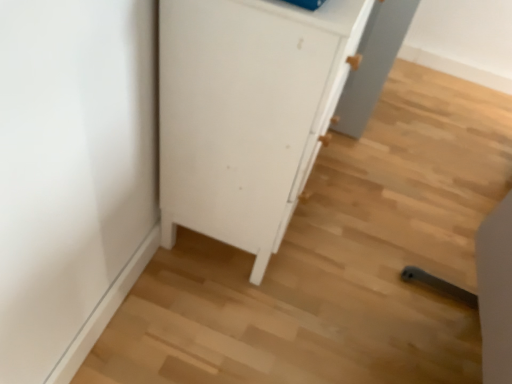
Question: From a real-world perspective, is light wood chair at lower right located higher than white matte cabinet at center?

Choices:
 (A) yes
 (B) no

Answer: (B)

Question: Does light wood chair at lower right contain white matte cabinet at center?

Choices:
 (A) no
 (B) yes

Answer: (A)

Question: Can you confirm if light wood chair at lower right is wider than white matte cabinet at center?

Choices:
 (A) yes
 (B) no

Answer: (A)

Question: Can you confirm if light wood chair at lower right is smaller than white matte cabinet at center?

Choices:
 (A) no
 (B) yes

Answer: (B)

Question: Does light wood chair at lower right lie in front of white matte cabinet at center?

Choices:
 (A) yes
 (B) no

Answer: (A)

Question: From the image's perspective, is light wood chair at lower right on top of white matte cabinet at center?

Choices:
 (A) no
 (B) yes

Answer: (A)

Question: From the image's perspective, is white matte cabinet at center located beneath light wood chair at lower right?

Choices:
 (A) yes
 (B) no

Answer: (B)

Question: Considering the relative positions of white matte cabinet at center and light wood chair at lower right in the image provided, is white matte cabinet at center to the left of light wood chair at lower right from the viewer's perspective?

Choices:
 (A) yes
 (B) no

Answer: (A)

Question: Is white matte cabinet at center to the right of light wood chair at lower right from the viewer's perspective?

Choices:
 (A) yes
 (B) no

Answer: (B)

Question: Does white matte cabinet at center contain light wood chair at lower right?

Choices:
 (A) no
 (B) yes

Answer: (A)

Question: Is light wood chair at lower right at the back of white matte cabinet at center?

Choices:
 (A) yes
 (B) no

Answer: (B)

Question: Does white matte cabinet at center lie in front of light wood chair at lower right?

Choices:
 (A) no
 (B) yes

Answer: (A)

Question: In terms of size, does white matte cabinet at center appear bigger or smaller than light wood chair at lower right?

Choices:
 (A) small
 (B) big

Answer: (B)